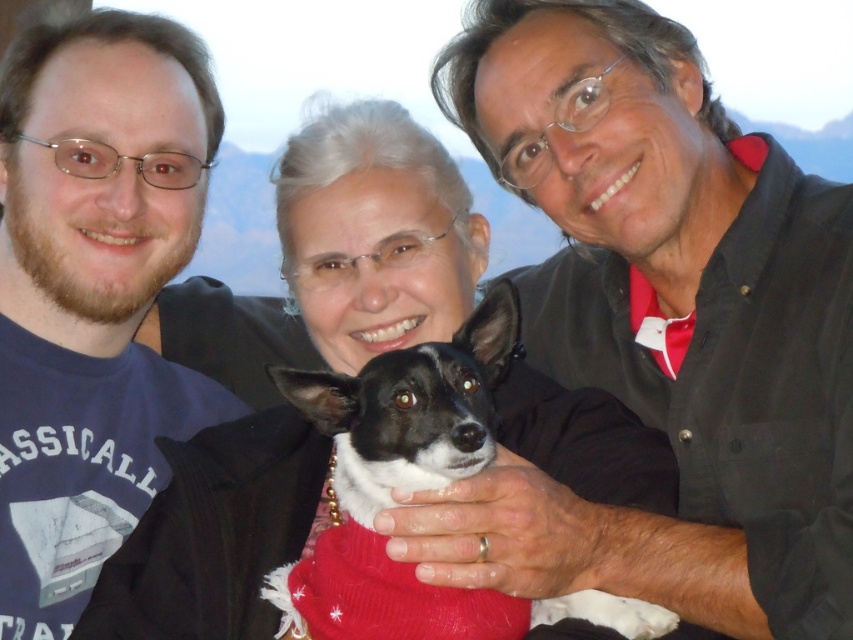
You are a photographer trying to adjust the lighting for a group photo. The black matte shirt at center and the matte blue shirt at left are in the frame. Which shirt should you focus on to ensure proper exposure, considering their sizes?

The black matte shirt at center is larger in size than the matte blue shirt at left, so focusing on the black matte shirt at center would ensure proper exposure since it occupies more of the frame.

You are a photographer trying to focus on the black matte shirt at center and the black and white fur at center. Which one of these two items should you adjust your camera focus to first if you want to ensure both are in focus, considering their sizes?

The black matte shirt at center is larger in size than black and white fur at center, so you should focus on the black matte shirt at center first to ensure both are in focus.